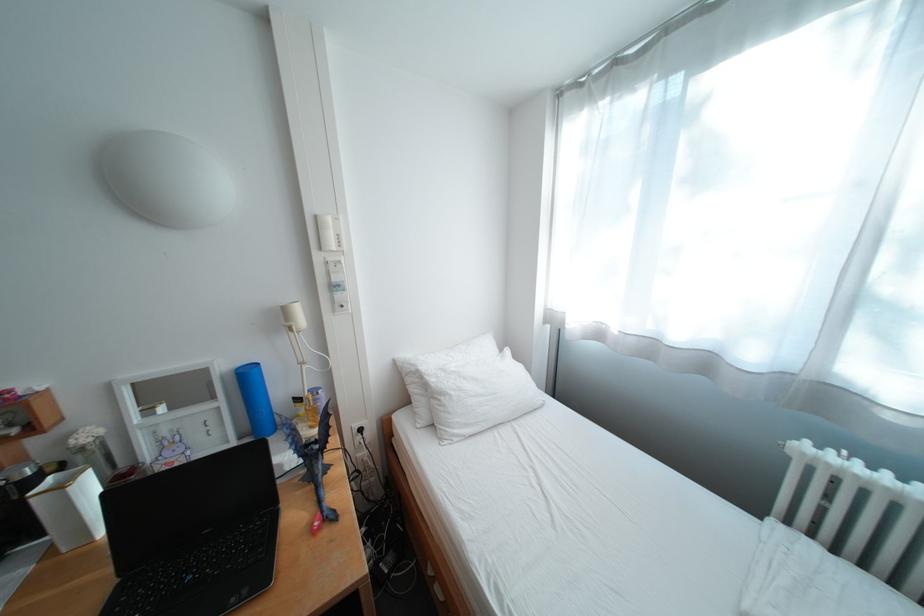
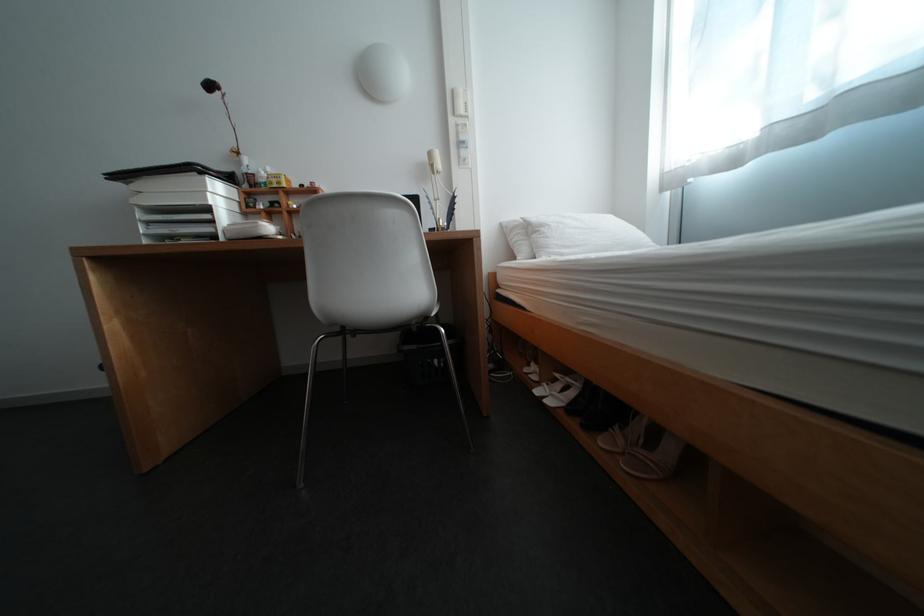
Locate, in the second image, the point that corresponds to (329,219) in the first image.

(466, 92)